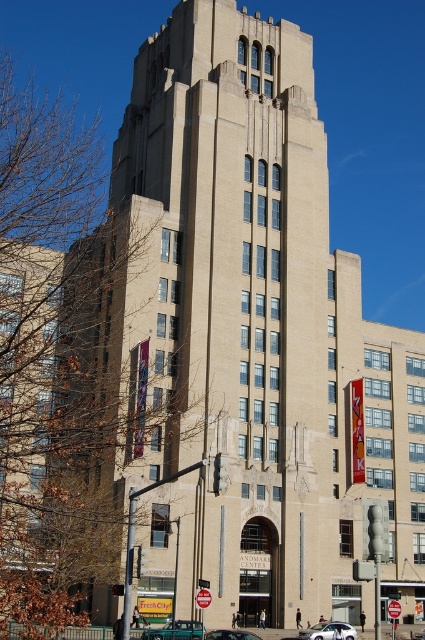
Question: Which of the following is the farthest from the observer?

Choices:
 (A) silver metallic sedan at center
 (B) metallic teal van at center

Answer: (A)

Question: Can you confirm if metallic teal van at center is bigger than metallic teal sedan at center?

Choices:
 (A) yes
 (B) no

Answer: (B)

Question: Can you confirm if metallic teal van at center is positioned to the left of metallic teal sedan at center?

Choices:
 (A) no
 (B) yes

Answer: (B)

Question: Which object is positioned closest to the metallic teal van at center?

Choices:
 (A) silver metallic sedan at center
 (B) metallic teal sedan at center

Answer: (B)

Question: Considering the real-world distances, which object is farthest from the metallic teal sedan at center?

Choices:
 (A) metallic teal van at center
 (B) silver metallic sedan at center

Answer: (B)

Question: Does metallic teal van at center have a lesser width compared to silver metallic sedan at center?

Choices:
 (A) yes
 (B) no

Answer: (B)